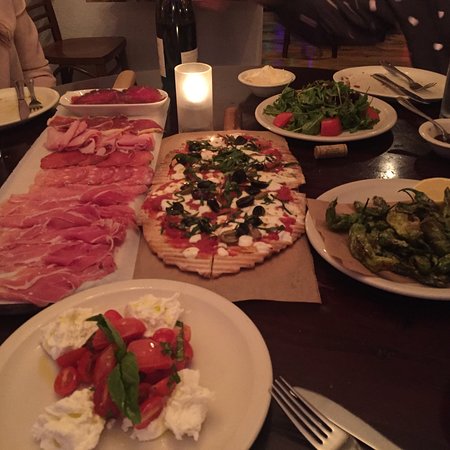
Where is `forks`? This screenshot has height=450, width=450. forks is located at coordinates (421, 87), (431, 118), (34, 102), (320, 431).